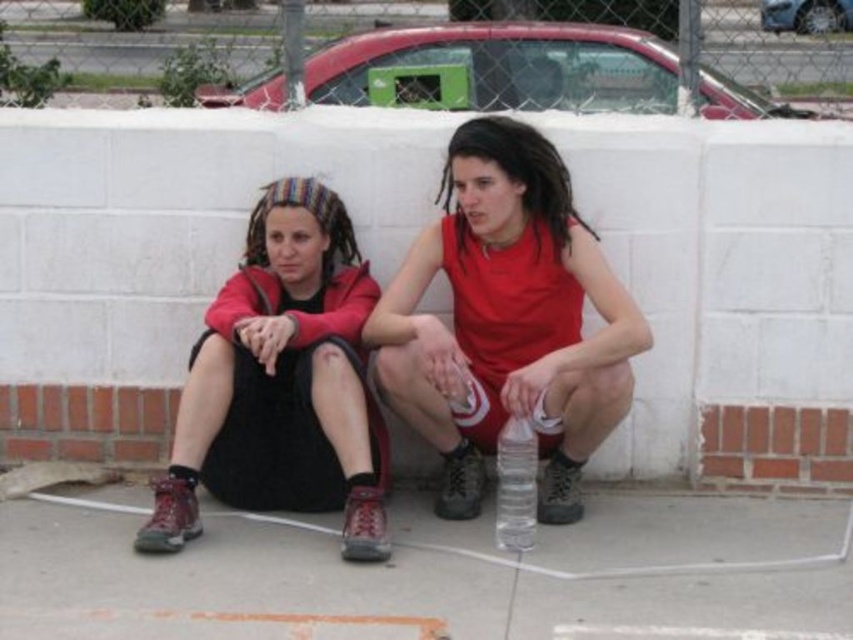
Who is more forward, (x=582, y=428) or (x=364, y=276)?

Point (x=582, y=428) is more forward.

Is red matte tank top at center positioned before matte red jacket at center?

No, red matte tank top at center is further to the viewer.

Does point (439, 392) come behind point (173, 541)?

Yes, point (439, 392) is farther from viewer.

The height and width of the screenshot is (640, 853). I want to click on red matte tank top at center, so pyautogui.click(x=508, y=321).

Between clear concrete pavement at lower center and red matte tank top at center, which one appears on the left side from the viewer's perspective?

Positioned to the left is clear concrete pavement at lower center.

Between point (74, 552) and point (419, 406), which one is positioned behind?

The point (419, 406) is behind.

Locate an element on the screen. Image resolution: width=853 pixels, height=640 pixels. clear concrete pavement at lower center is located at coordinates (432, 573).

Which of these two, clear concrete pavement at lower center or matte red jacket at center, stands taller?

With more height is matte red jacket at center.

Find the location of a particular element. This screenshot has width=853, height=640. clear concrete pavement at lower center is located at coordinates (432, 573).